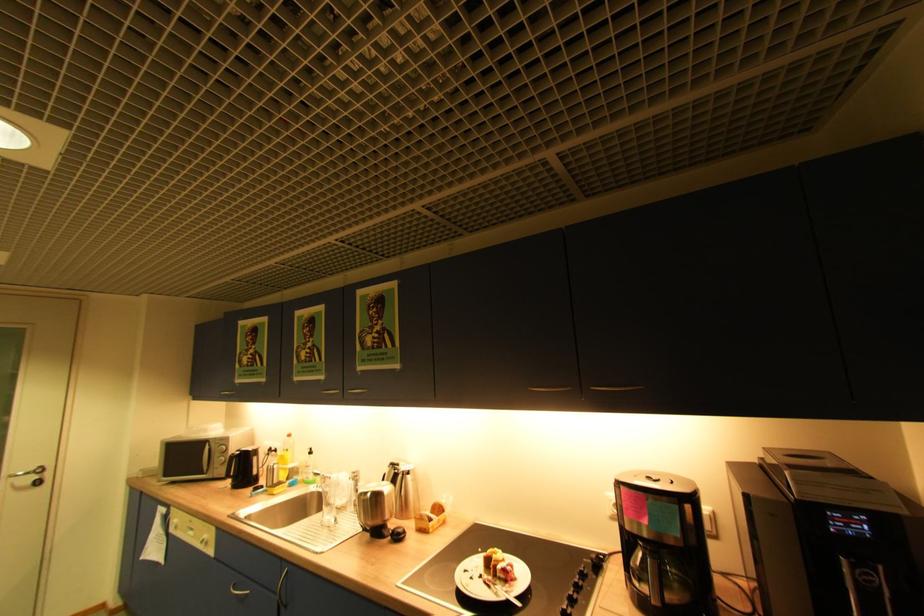
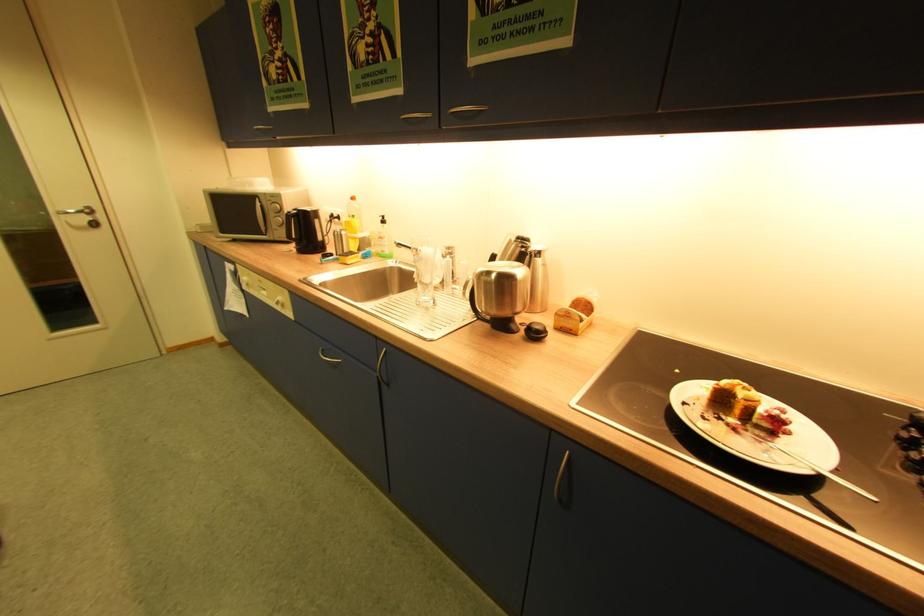
Locate, in the second image, the point that corresponds to (314,456) in the first image.

(386, 225)